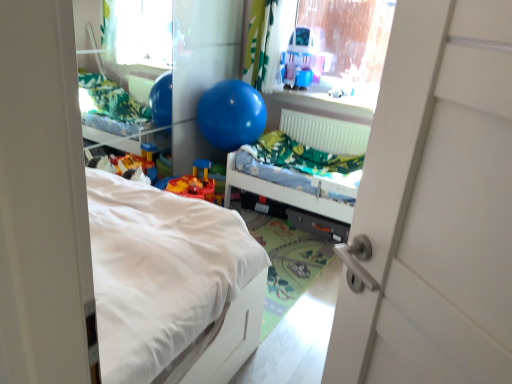
Question: Is blue rubber balloon at upper center wider or thinner than translucent plastic playhouse at upper center?

Choices:
 (A) wide
 (B) thin

Answer: (A)

Question: Visually, is blue rubber balloon at upper center positioned to the left or to the right of translucent plastic playhouse at upper center?

Choices:
 (A) right
 (B) left

Answer: (B)

Question: Estimate the real-world distances between objects in this image. Which object is farther from the white plastic radiator at upper center?

Choices:
 (A) transparent plastic window screen at upper center
 (B) green fabric curtain at upper center
 (C) translucent plastic playhouse at upper center
 (D) blue rubber balloon at upper center
 (E) blue rubber ball at center

Answer: (B)

Question: Which object is the closest to the blue rubber ball at center?

Choices:
 (A) green fabric curtain at upper center
 (B) transparent plastic window screen at upper center
 (C) white plastic radiator at upper center
 (D) translucent plastic playhouse at upper center
 (E) blue rubber balloon at upper center

Answer: (C)